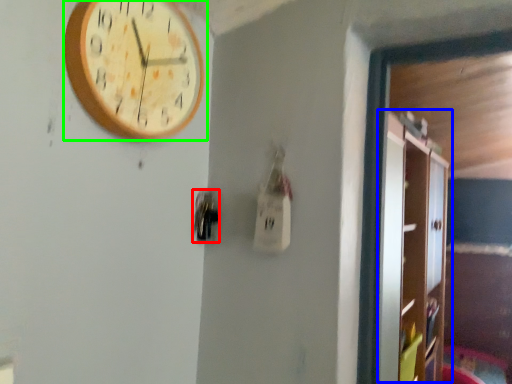
Question: Estimate the real-world distances between objects in this image. Which object is closer to door handle (highlighted by a red box), dresser (highlighted by a blue box) or wall clock (highlighted by a green box)?

Choices:
 (A) dresser
 (B) wall clock

Answer: (B)